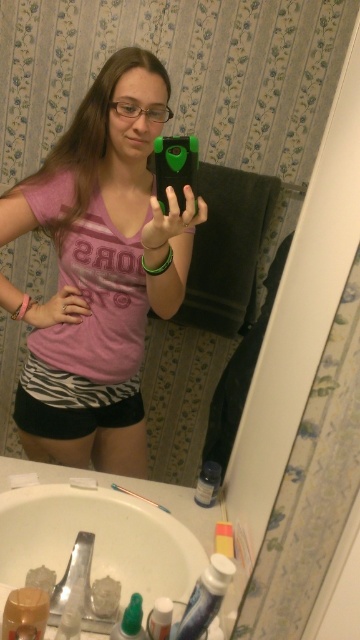
Can you confirm if zebra print shorts at lower center is taller than green matte phone at center?

Indeed, zebra print shorts at lower center has a greater height compared to green matte phone at center.

Is point (38, 404) less distant than point (192, 177)?

No.

This screenshot has width=360, height=640. In order to click on zebra print shorts at lower center in this screenshot , I will do (72, 403).

Who is positioned more to the right, white ceramic sink at lower left or green matte phone at center?

green matte phone at center

Which of these two, white ceramic sink at lower left or green matte phone at center, stands shorter?

green matte phone at center is shorter.

Does point (6, 556) come farther from viewer compared to point (173, 138)?

Yes, it is.

Locate an element on the screen. Image resolution: width=360 pixels, height=640 pixels. white ceramic sink at lower left is located at coordinates (99, 540).

Looking at this image, can you confirm if pink matte shirt at center is positioned to the left of white ceramic sink at lower left?

Correct, you'll find pink matte shirt at center to the left of white ceramic sink at lower left.

Does pink matte shirt at center appear under white ceramic sink at lower left?

Actually, pink matte shirt at center is above white ceramic sink at lower left.

This screenshot has width=360, height=640. I want to click on pink matte shirt at center, so click(x=99, y=272).